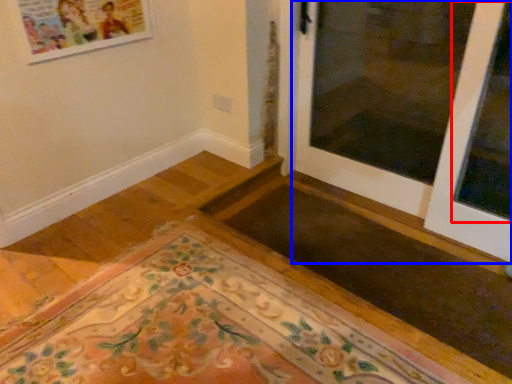
Question: Which of the following is the closest to the observer, window (highlighted by a red box) or door (highlighted by a blue box)?

Choices:
 (A) window
 (B) door

Answer: (B)